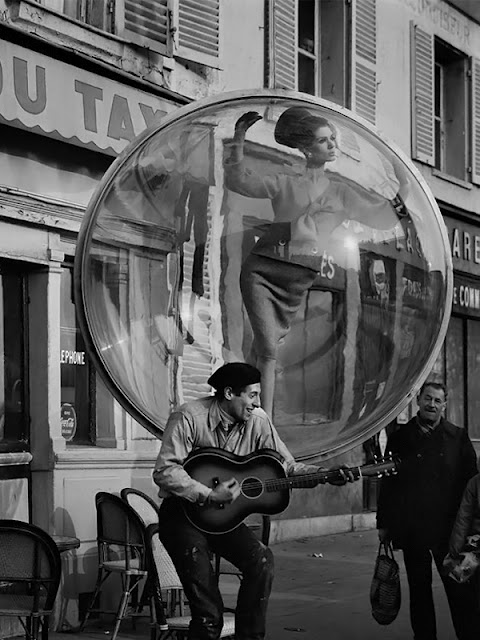
Identify the location of chair. (117, 541), (41, 564).